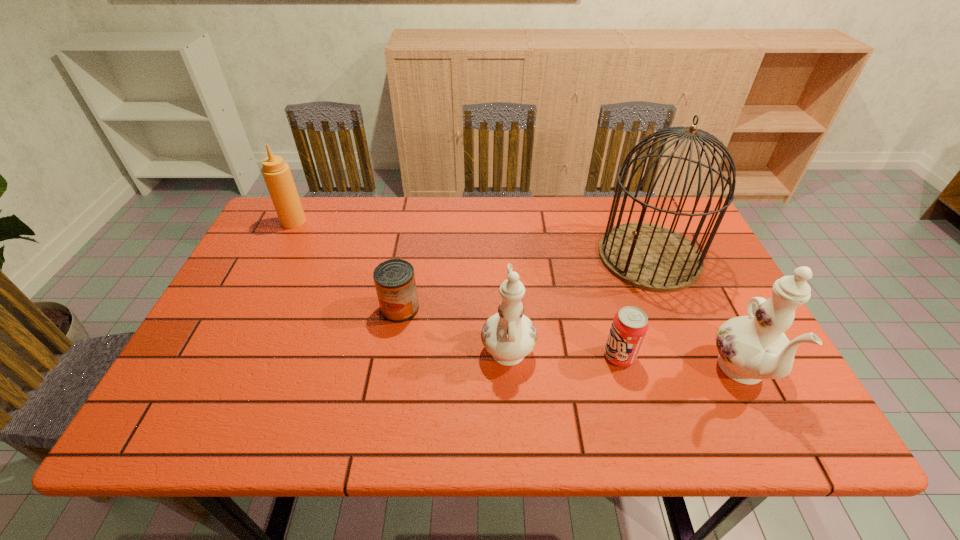
Find the location of a particular element. blank space located on the back of the leftmost object is located at coordinates (301, 205).

At what (x,y) coordinates should I click in order to perform the action: click on free spot located at the door of the birdcage. Please return your answer as a coordinate pair (x, y). Looking at the image, I should click on (684, 341).

Locate an element on the screen. This screenshot has height=540, width=960. free region located on the right of the can is located at coordinates (498, 308).

Locate an element on the screen. The width and height of the screenshot is (960, 540). blank space located on the surface of the soda can is located at coordinates (568, 356).

What are the coordinates of `free space located 0.310m on the surface of the soda can` in the screenshot? It's located at (468, 356).

At what (x,y) coordinates should I click in order to perform the action: click on vacant space located 0.350m on the surface of the soda can. Please return your answer as a coordinate pair (x, y). Looking at the image, I should click on (450, 356).

This screenshot has width=960, height=540. I want to click on condiment that is positioned at the far edge, so click(277, 175).

The image size is (960, 540). I want to click on birdcage that is at the far edge, so click(648, 256).

Locate an element on the screen. This screenshot has width=960, height=540. soda can that is at the near edge is located at coordinates (630, 325).

At what (x,y) coordinates should I click in order to perform the action: click on object situated at the left edge. Please return your answer as a coordinate pair (x, y). The width and height of the screenshot is (960, 540). Looking at the image, I should click on (277, 175).